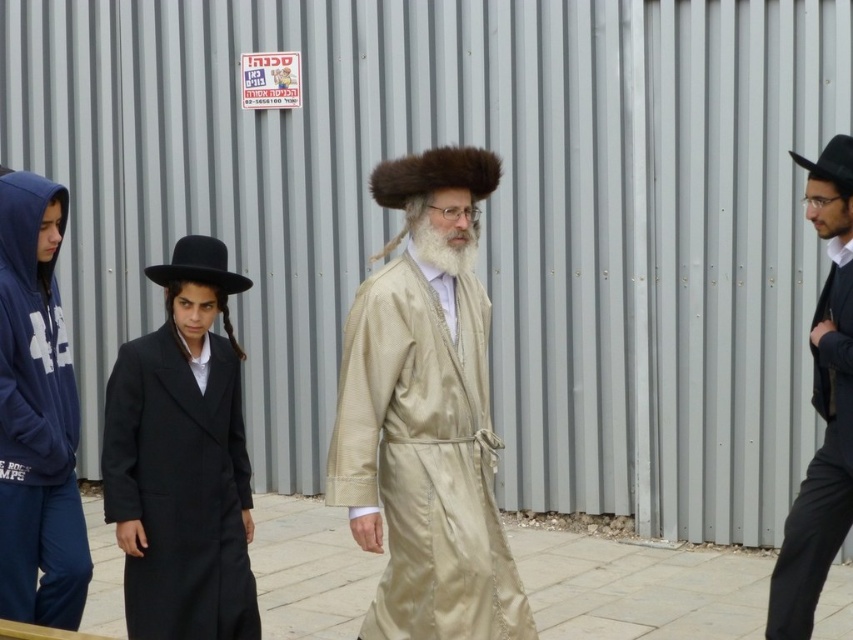
Question: Which of these objects is positioned farthest from the black felt hat at center?

Choices:
 (A) fuzzy brown hat at center
 (B) black woolen coat at center
 (C) satin beige robe at center

Answer: (C)

Question: Which of the following is the closest to the observer?

Choices:
 (A) black felt hat at center
 (B) black felt hat at upper right
 (C) beige stone pavement at center

Answer: (A)

Question: Is satin beige robe at center closer to camera compared to fuzzy brown hat at center?

Choices:
 (A) yes
 (B) no

Answer: (A)

Question: Does satin beige robe at center have a lesser width compared to white matte beard at center?

Choices:
 (A) no
 (B) yes

Answer: (A)

Question: Is black woolen coat at center bigger than beige stone pavement at center?

Choices:
 (A) no
 (B) yes

Answer: (A)

Question: Which object is farther from the camera taking this photo?

Choices:
 (A) fuzzy brown hat at center
 (B) black satin hat at right
 (C) black woolen coat at center

Answer: (B)